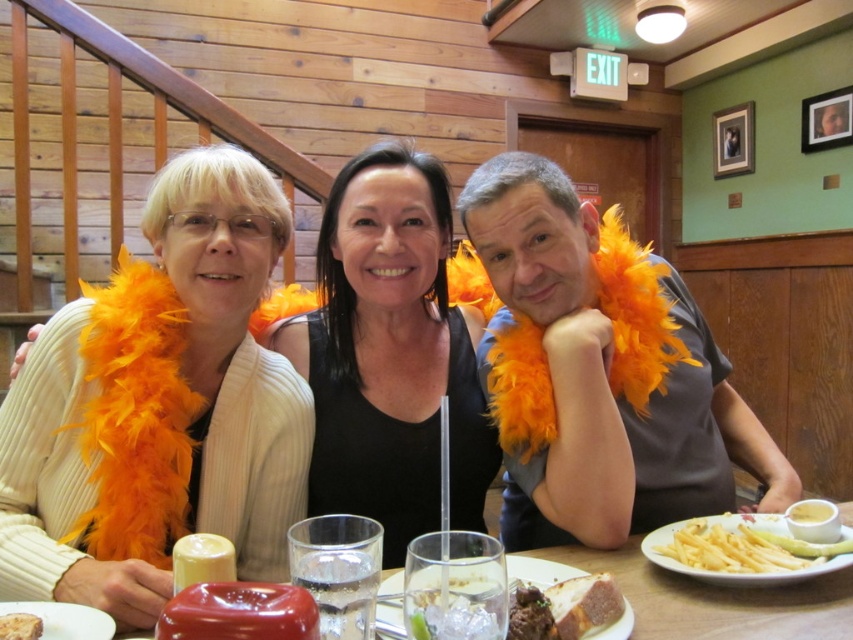
Question: Does black matte feather boa at center have a lesser width compared to golden brown crusty bread at lower center?

Choices:
 (A) no
 (B) yes

Answer: (A)

Question: Observing the image, what is the correct spatial positioning of matte red plate at lower left in reference to smooth white cake at center?

Choices:
 (A) above
 (B) below

Answer: (B)

Question: Among these objects, which one is nearest to the camera?

Choices:
 (A) orange feather boa at center
 (B) smooth white cake at center
 (C) black matte feather boa at center
 (D) matte orange feather boa at left

Answer: (B)

Question: Which of these objects is positioned farthest from the matte plastic bottle at center?

Choices:
 (A) orange feather boa at center
 (B) smooth white cake at center

Answer: (B)

Question: Which point is closer to the camera?

Choices:
 (A) (558, 605)
 (B) (38, 637)
 (C) (718, 573)
 (D) (50, 387)

Answer: (B)

Question: Is black matte feather boa at center to the right of matte red plate at lower left from the viewer's perspective?

Choices:
 (A) no
 (B) yes

Answer: (B)